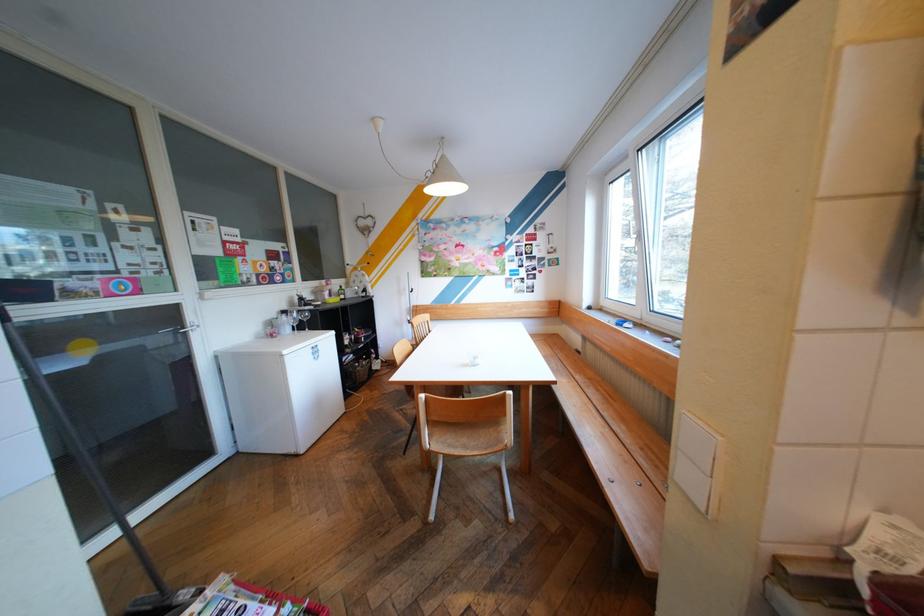
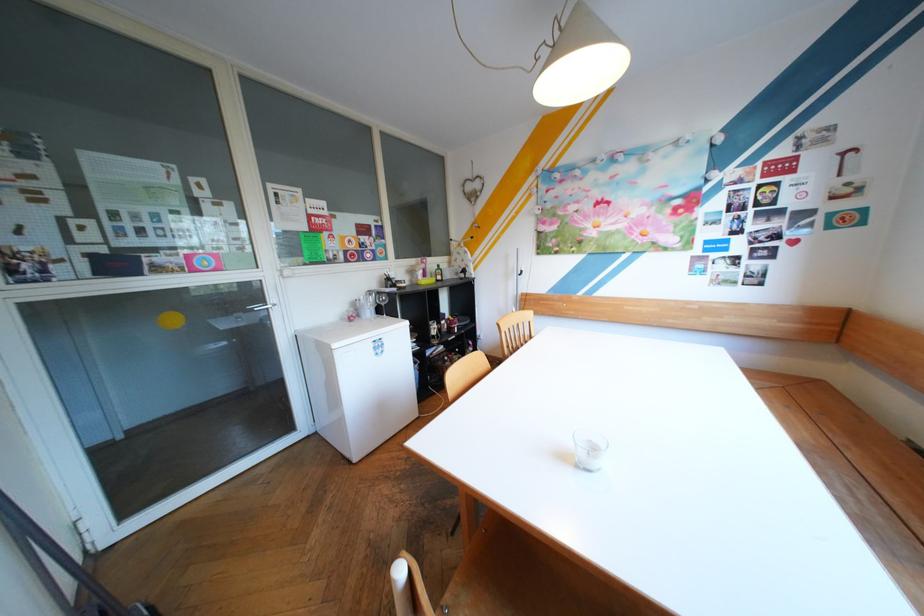
Where in the second image is the point corresponding to (297,310) from the first image?

(383, 292)